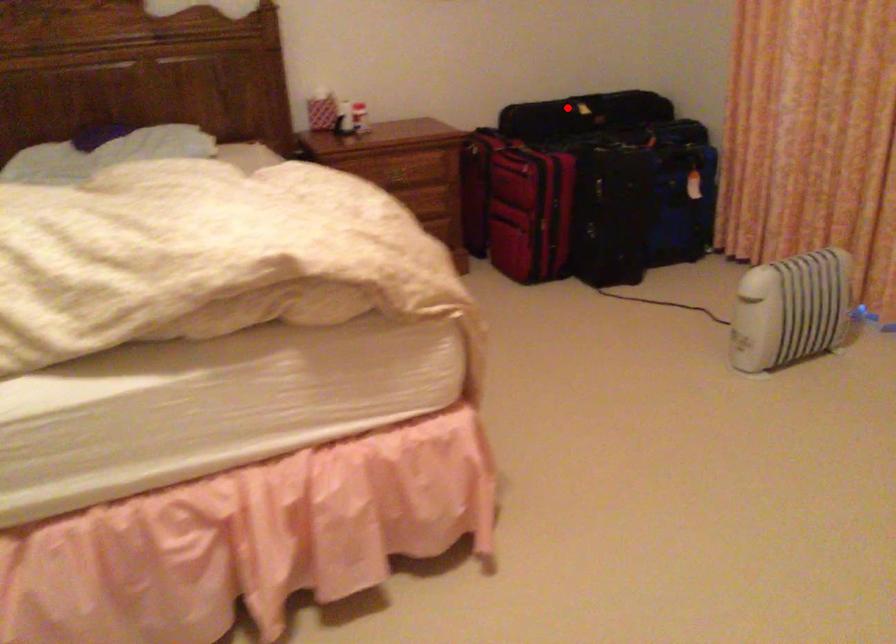
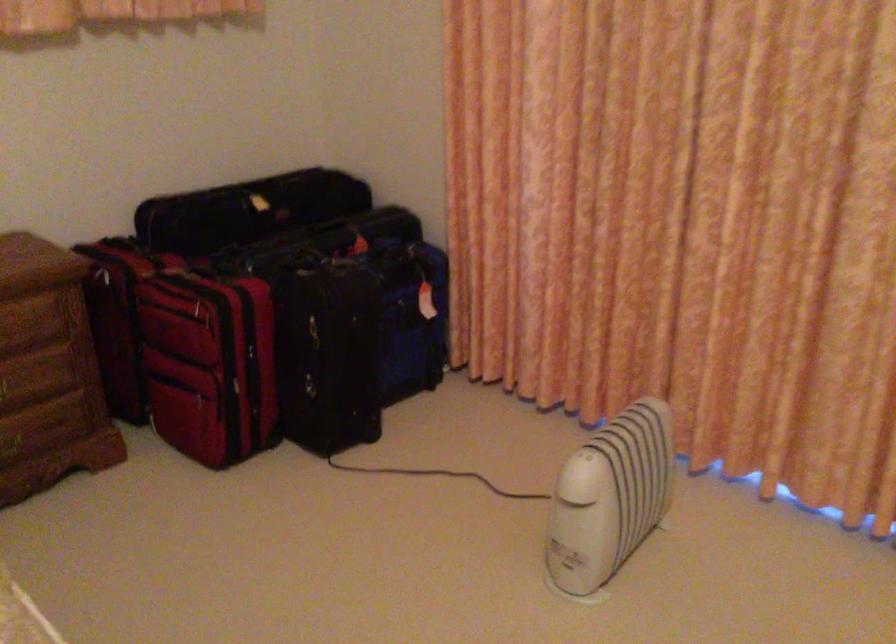
Where in the second image is the point corresponding to the highlighted location from the first image?

(247, 210)